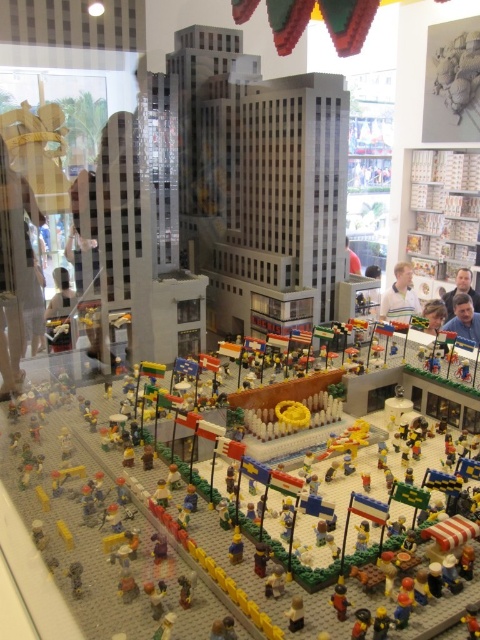
Does matte yellow minifigure at center have a lesser height compared to yellow matte figure at center?

Yes.

Does matte yellow minifigure at center appear over yellow matte figure at center?

Actually, matte yellow minifigure at center is below yellow matte figure at center.

Is point (336, 596) positioned behind point (232, 536)?

No, it is in front of (232, 536).

Image resolution: width=480 pixels, height=640 pixels. Find the location of `matte yellow minifigure at center`. matte yellow minifigure at center is located at coordinates (339, 602).

Does smooth blue shirt at center have a greater height compared to brick-like yellow car at center?

Correct, smooth blue shirt at center is much taller as brick-like yellow car at center.

Is point (447, 300) positioned after point (475, 628)?

Yes, point (447, 300) is behind point (475, 628).

You are a GUI agent. You are given a task and a screenshot of the screen. Output one action in this format:
    pyautogui.click(x=<x>, y=<y>)
    Task: Click on the smooth blue shirt at center
    This screenshot has height=640, width=480.
    Given the screenshot: What is the action you would take?
    pyautogui.click(x=460, y=291)

Is matte black man at lower right closer to camera compared to smooth blue shirt at center?

Yes, it is in front of smooth blue shirt at center.

Can you confirm if matte black man at lower right is taller than smooth blue shirt at center?

Incorrect, matte black man at lower right's height is not larger of smooth blue shirt at center's.

This screenshot has height=640, width=480. I want to click on matte black man at lower right, so click(464, 320).

You are a GUI agent. You are given a task and a screenshot of the screen. Output one action in this format:
    pyautogui.click(x=<x>, y=<y>)
    Task: Click on the matte black man at lower right
    The width and height of the screenshot is (480, 640).
    Given the screenshot: What is the action you would take?
    pyautogui.click(x=464, y=320)